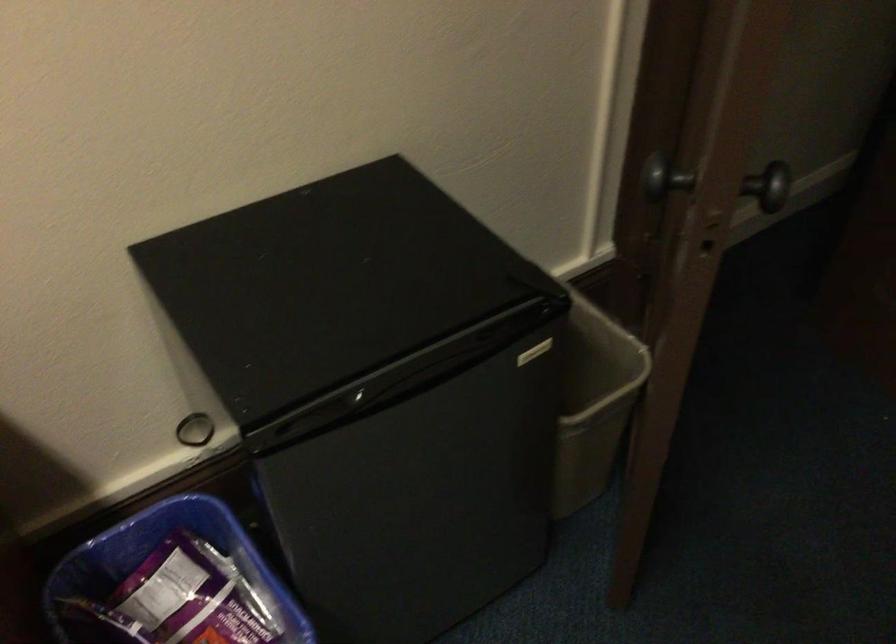
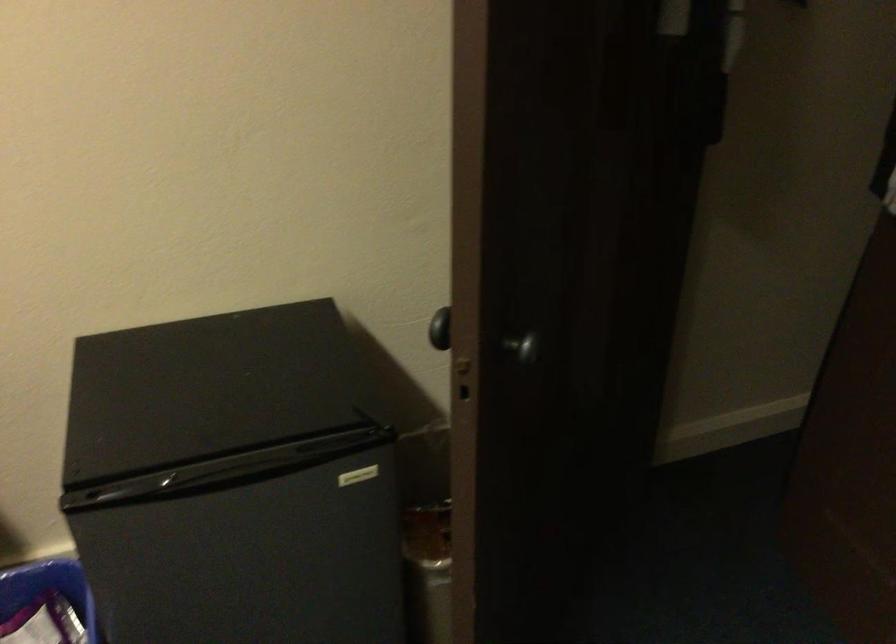
The point at (659,184) is marked in the first image. Where is the corresponding point in the second image?

(440, 328)